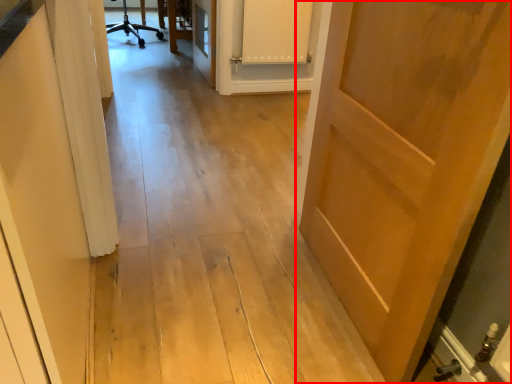
Question: Where is door (annotated by the red box) located in relation to cabinetry in the image?

Choices:
 (A) right
 (B) left

Answer: (A)